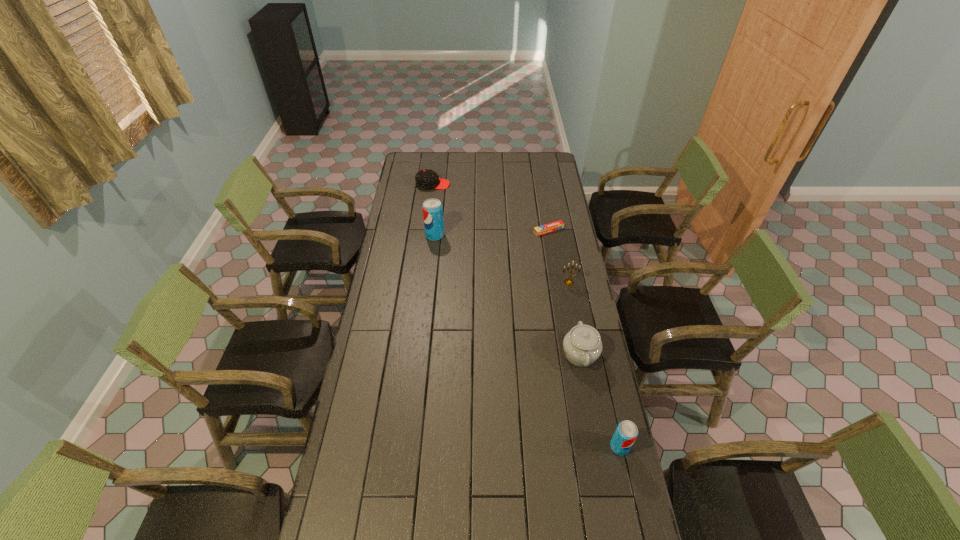
This screenshot has height=540, width=960. In order to click on vacant space at the far edge of the desktop in this screenshot , I will do `click(509, 152)`.

At what (x,y) coordinates should I click in order to perform the action: click on vacant space at the near edge of the desktop. Please return your answer as a coordinate pair (x, y). The width and height of the screenshot is (960, 540). Looking at the image, I should click on (524, 501).

This screenshot has height=540, width=960. Find the location of `free space at the left edge of the desktop`. free space at the left edge of the desktop is located at coordinates (411, 250).

In the image, there is a desktop. Identify the location of vacant area at the right edge. This screenshot has height=540, width=960. (567, 421).

Where is `free space at the far left corner of the desktop`? The height and width of the screenshot is (540, 960). free space at the far left corner of the desktop is located at coordinates (412, 167).

The width and height of the screenshot is (960, 540). Identify the location of vacant area at the far right corner. (555, 166).

The height and width of the screenshot is (540, 960). I want to click on free spot at the near right corner of the desktop, so click(623, 529).

Where is `free space between the second nearest object and the shortest object`? free space between the second nearest object and the shortest object is located at coordinates (564, 292).

Where is `empty location between the nearest object and the second shortest object`? Image resolution: width=960 pixels, height=540 pixels. empty location between the nearest object and the second shortest object is located at coordinates (526, 315).

You are a GUI agent. You are given a task and a screenshot of the screen. Output one action in this format:
    pyautogui.click(x=<x>, y=<y>)
    Task: Click on the vacant area between the nearest object and the chinaware
    The image size is (960, 540).
    Given the screenshot: What is the action you would take?
    pyautogui.click(x=600, y=401)